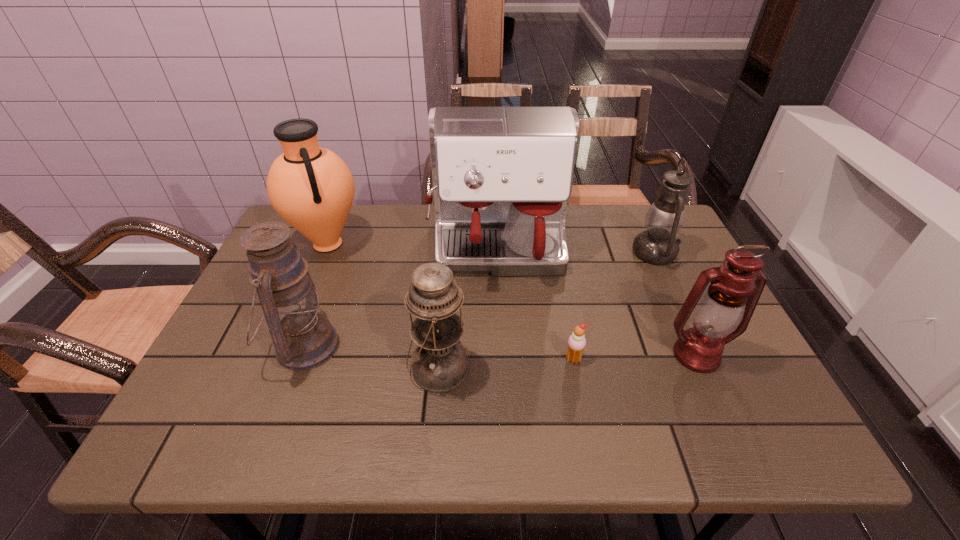
Locate an element on the screen. The width and height of the screenshot is (960, 540). vacant region located on the right of the third oil lamp from right to left is located at coordinates 557,369.

The width and height of the screenshot is (960, 540). What are the coordinates of `vacant region located 0.060m at the front with a straw on the shortest object` in the screenshot? It's located at (579, 390).

At what (x,y) coordinates should I click in order to perform the action: click on coffee maker located at the far edge. Please return your answer as a coordinate pair (x, y). This screenshot has width=960, height=540. Looking at the image, I should click on (502, 177).

The image size is (960, 540). I want to click on pitcher situated at the far edge, so click(310, 187).

In order to click on oil lamp that is positioned at the far edge in this screenshot , I will do [x=657, y=245].

The image size is (960, 540). In order to click on pitcher that is at the left edge in this screenshot , I will do `click(310, 187)`.

Identify the location of oil lamp that is at the left edge. 303,339.

This screenshot has width=960, height=540. Identify the location of object that is at the far left corner. (310, 187).

Where is `object positioned at the far right corner`? This screenshot has height=540, width=960. object positioned at the far right corner is located at coordinates (657, 245).

Where is `vacant position at the far edge of the desktop`? vacant position at the far edge of the desktop is located at coordinates (425, 231).